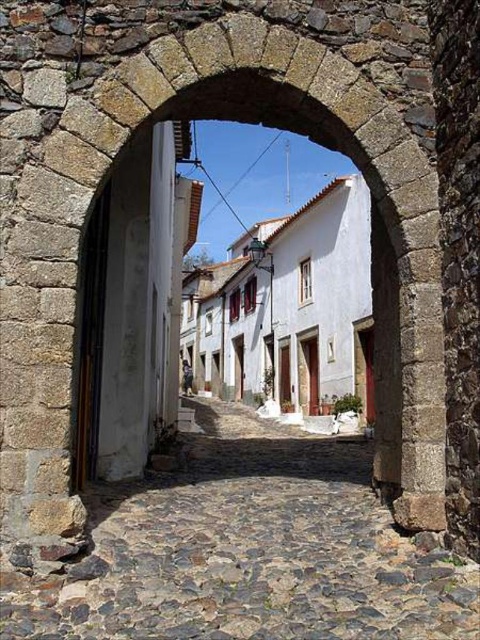
Between point (409, 547) and point (325, 202), which one is positioned in front?

Point (409, 547) is more forward.

What do you see at coordinates (250, 550) in the screenshot? This screenshot has height=640, width=480. I see `cobblestone path at center` at bounding box center [250, 550].

Identify the location of cobblestone path at center. (250, 550).